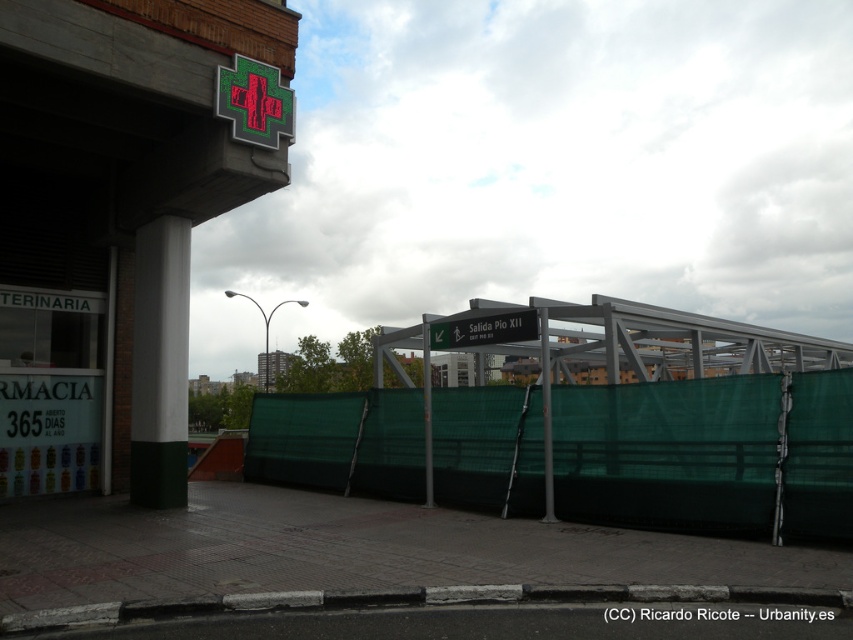
Question: Can you confirm if green mesh barrier at center is wider than green metallic signpost at center?

Choices:
 (A) yes
 (B) no

Answer: (A)

Question: Which object is positioned farthest from the green metallic sign at center?

Choices:
 (A) green mesh barrier at center
 (B) green matte cross at upper center

Answer: (B)

Question: Which point is farther to the camera?

Choices:
 (A) green metallic signpost at center
 (B) green mesh barrier at center

Answer: (A)

Question: Based on their relative distances, which object is nearer to the green matte cross at upper center?

Choices:
 (A) metallic gray pole at center
 (B) green metallic signpost at center
 (C) green mesh barrier at center
 (D) green metallic sign at center

Answer: (D)

Question: Can you confirm if green mesh barrier at center is positioned to the left of green matte cross at upper center?

Choices:
 (A) yes
 (B) no

Answer: (B)

Question: Does green matte cross at upper center have a lesser width compared to metallic gray pole at center?

Choices:
 (A) yes
 (B) no

Answer: (B)